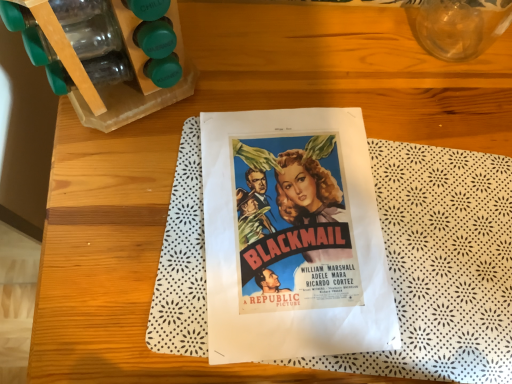
What is the approximate width of vivid paper poster at center?

vivid paper poster at center is 12.63 inches in width.

Where is `vivid paper poster at center`? vivid paper poster at center is located at coordinates (292, 237).

The image size is (512, 384). What do you see at coordinates (292, 237) in the screenshot?
I see `vivid paper poster at center` at bounding box center [292, 237].

The height and width of the screenshot is (384, 512). What do you see at coordinates (457, 25) in the screenshot?
I see `transparent glass vase at upper right` at bounding box center [457, 25].

Where is `transparent glass vase at upper right`? This screenshot has height=384, width=512. transparent glass vase at upper right is located at coordinates (457, 25).

Where is `vivid paper poster at center`? This screenshot has height=384, width=512. vivid paper poster at center is located at coordinates (292, 237).

Is vivid paper poster at center to the right of transparent glass vase at upper right from the viewer's perspective?

In fact, vivid paper poster at center is to the left of transparent glass vase at upper right.

Relative to transparent glass vase at upper right, is vivid paper poster at center in front or behind?

vivid paper poster at center is positioned farther from the viewer than transparent glass vase at upper right.

Is point (323, 216) positioned before point (467, 3)?

Yes, it is in front of point (467, 3).

From the image's perspective, would you say vivid paper poster at center is positioned over transparent glass vase at upper right?

No, from the image's perspective, vivid paper poster at center is not above transparent glass vase at upper right.

From a real-world perspective, is vivid paper poster at center located higher than transparent glass vase at upper right?

No, from a real-world perspective, vivid paper poster at center is not on top of transparent glass vase at upper right.

Based on the photo, between vivid paper poster at center and transparent glass vase at upper right, which one has smaller width?

With smaller width is transparent glass vase at upper right.

Who is shorter, vivid paper poster at center or transparent glass vase at upper right?

With less height is vivid paper poster at center.

Based on their sizes in the image, would you say vivid paper poster at center is bigger or smaller than transparent glass vase at upper right?

Considering their sizes, vivid paper poster at center takes up less space than transparent glass vase at upper right.

Is vivid paper poster at center positioned beyond the bounds of transparent glass vase at upper right?

vivid paper poster at center lies outside transparent glass vase at upper right's area.

Does vivid paper poster at center touch transparent glass vase at upper right?

No, vivid paper poster at center is not with transparent glass vase at upper right.

Is vivid paper poster at center looking in the opposite direction of transparent glass vase at upper right?

No, vivid paper poster at center's orientation is not away from transparent glass vase at upper right.

Where is `glass vase that is on the right side of vivid paper poster at center`? The height and width of the screenshot is (384, 512). glass vase that is on the right side of vivid paper poster at center is located at coordinates (457, 25).

Considering the relative positions of transparent glass vase at upper right and vivid paper poster at center in the image provided, is transparent glass vase at upper right to the left of vivid paper poster at center from the viewer's perspective?

No, transparent glass vase at upper right is not to the left of vivid paper poster at center.

Is transparent glass vase at upper right in front of or behind vivid paper poster at center in the image?

In the image, transparent glass vase at upper right appears in front of vivid paper poster at center.

Between point (409, 11) and point (297, 336), which one is positioned in front?

The point (297, 336) is closer.

Looking at this image, from the image's perspective, is transparent glass vase at upper right on top of vivid paper poster at center?

Yes, from the image's perspective, transparent glass vase at upper right is over vivid paper poster at center.

From the picture: From a real-world perspective, which object stands above the other?

In real-world perspective, transparent glass vase at upper right is above.

Can you confirm if transparent glass vase at upper right is thinner than vivid paper poster at center?

Correct, the width of transparent glass vase at upper right is less than that of vivid paper poster at center.

Considering the relative sizes of transparent glass vase at upper right and vivid paper poster at center in the image provided, is transparent glass vase at upper right taller than vivid paper poster at center?

Yes, transparent glass vase at upper right is taller than vivid paper poster at center.

Based on their sizes in the image, would you say transparent glass vase at upper right is bigger or smaller than vivid paper poster at center?

Clearly, transparent glass vase at upper right is larger in size than vivid paper poster at center.

Is transparent glass vase at upper right not inside vivid paper poster at center?

transparent glass vase at upper right is positioned outside vivid paper poster at center.

Are transparent glass vase at upper right and vivid paper poster at center far apart?

They are positioned close to each other.

Is transparent glass vase at upper right looking in the opposite direction of vivid paper poster at center?

No, transparent glass vase at upper right's orientation is not away from vivid paper poster at center.

Where is `glass vase above the vivid paper poster at center (from the image's perspective)`? The height and width of the screenshot is (384, 512). glass vase above the vivid paper poster at center (from the image's perspective) is located at coordinates (457, 25).

Find the location of a particular element. The height and width of the screenshot is (384, 512). paperback book on the left of transparent glass vase at upper right is located at coordinates (292, 237).

The width and height of the screenshot is (512, 384). What are the coordinates of `glass vase lying above the vivid paper poster at center (from the image's perspective)` in the screenshot? It's located at (457, 25).